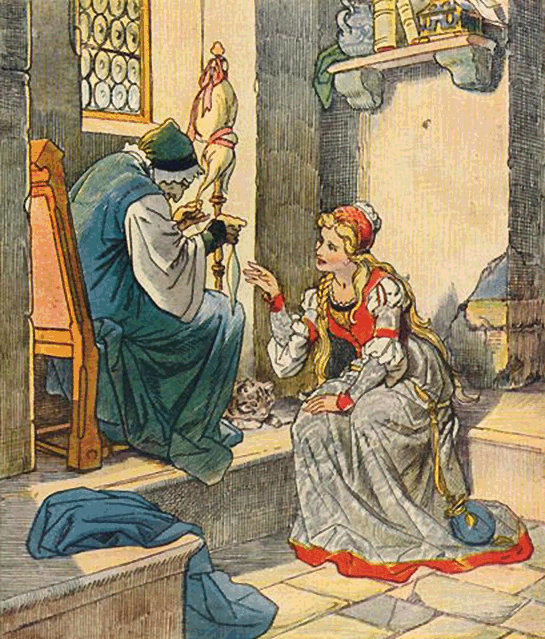
The image size is (545, 639). In order to click on chair in this screenshot , I will do [82, 347].